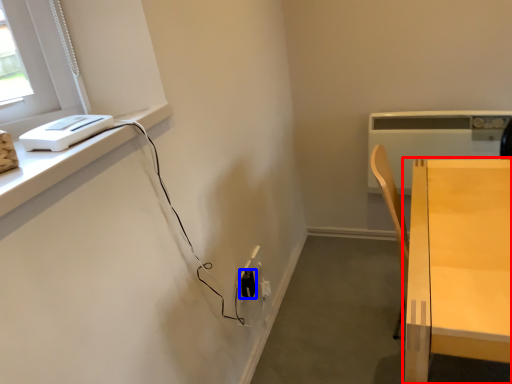
Question: Which point is further to the camera, table (highlighted by a red box) or electric outlet (highlighted by a blue box)?

Choices:
 (A) table
 (B) electric outlet

Answer: (B)